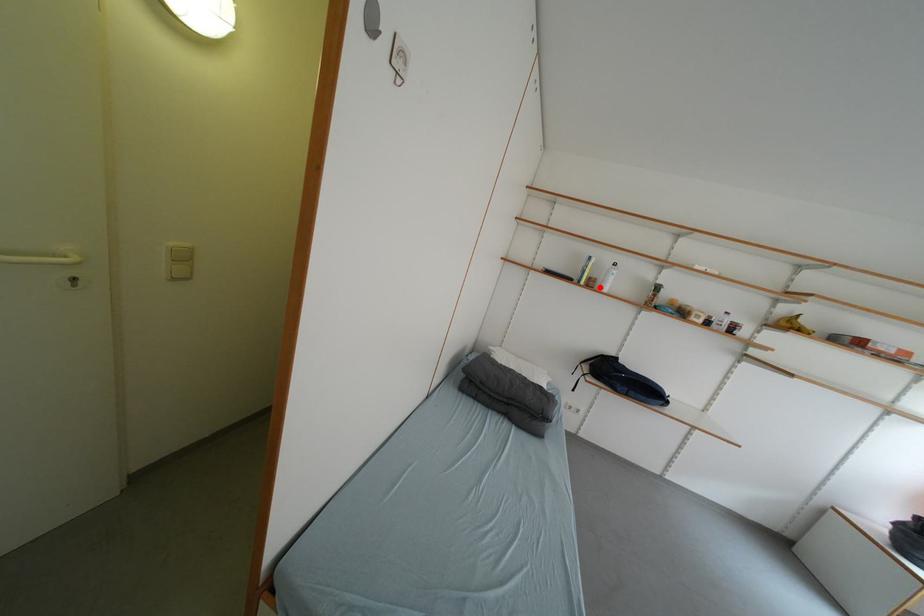
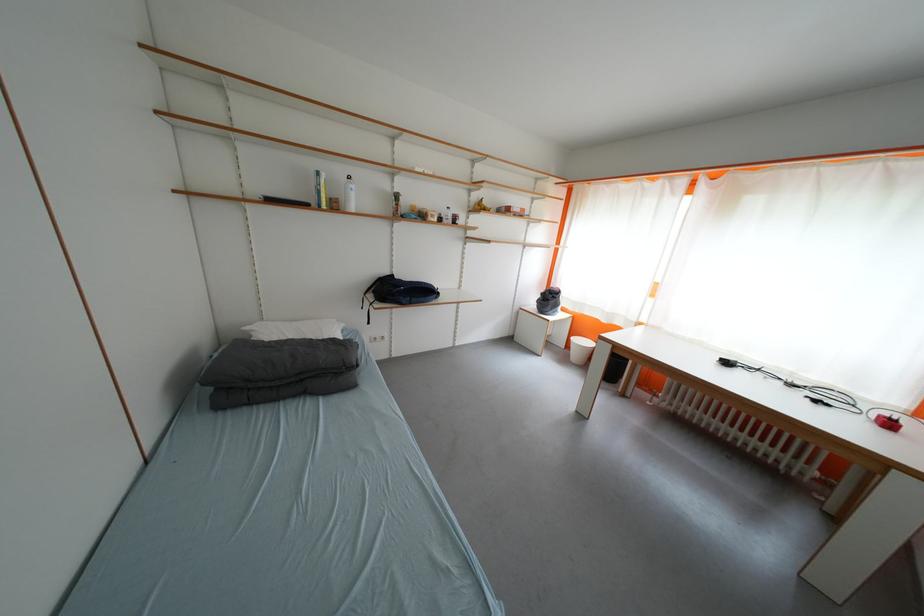
The point at the highlighted location is marked in the first image. Where is the corresponding point in the second image?

(344, 209)